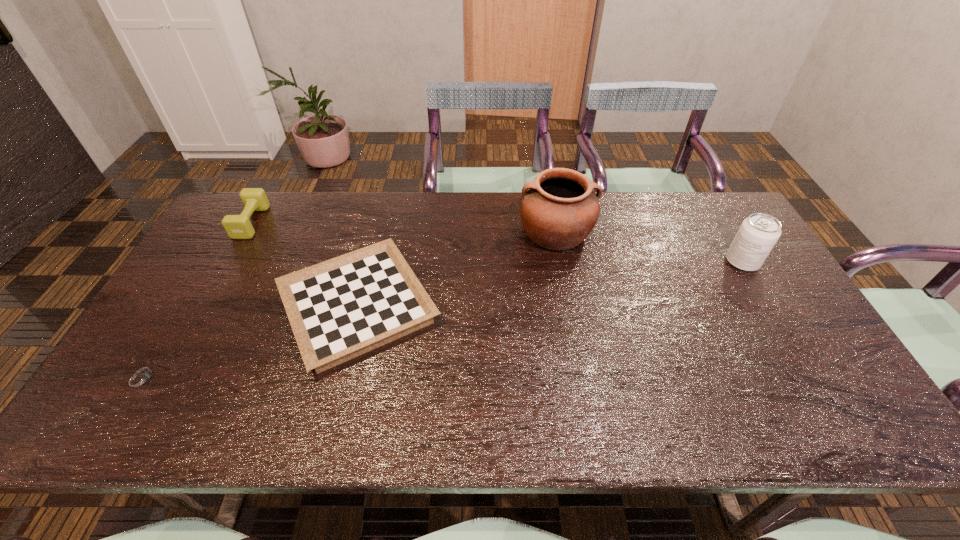
In the image, there is a desktop. Where is `vacant space at the near edge`? This screenshot has height=540, width=960. vacant space at the near edge is located at coordinates (260, 402).

The image size is (960, 540). Identify the location of vacant space at the left edge. (200, 280).

You are a GUI agent. You are given a task and a screenshot of the screen. Output one action in this format:
    pyautogui.click(x=<x>, y=<y>)
    Task: Click on the free location at the right edge
    
    Given the screenshot: What is the action you would take?
    pyautogui.click(x=766, y=303)

In the image, there is a desktop. What are the coordinates of `free space at the near right corner` in the screenshot? It's located at (864, 417).

Where is `vacant region between the checkerboard and the dumbbell`? vacant region between the checkerboard and the dumbbell is located at coordinates (304, 265).

The image size is (960, 540). I want to click on unoccupied position between the shortest object and the fourth shortest object, so click(x=443, y=320).

In order to click on blank region between the pottery and the fourth tallest object in this screenshot , I will do `click(457, 269)`.

Identify the location of vacant space in between the dumbbell and the second tallest object. The height and width of the screenshot is (540, 960). (496, 242).

Where is `free area in between the second shortest object and the third shortest object`? The width and height of the screenshot is (960, 540). free area in between the second shortest object and the third shortest object is located at coordinates (304, 265).

The width and height of the screenshot is (960, 540). In order to click on vacant region between the third shortest object and the fourth object from left to right in this screenshot , I will do `click(403, 227)`.